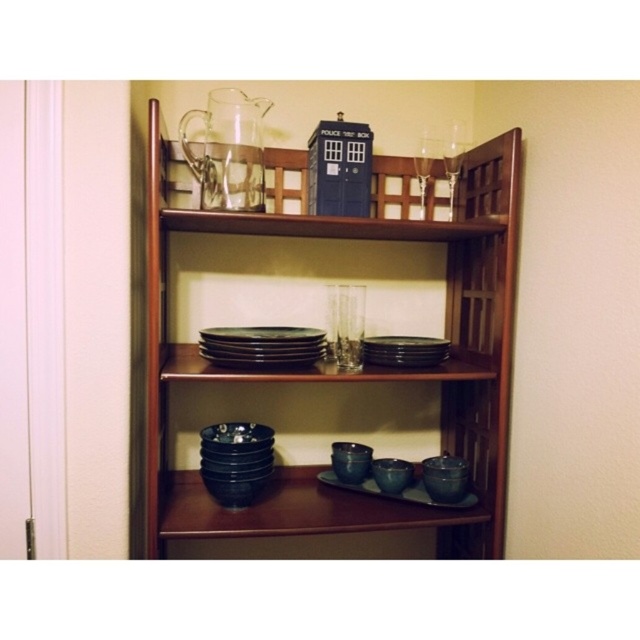
Does transparent glass wine glass at upper right lie behind clear glass wine glass at upper right?

No.

The image size is (640, 640). In order to click on transparent glass wine glass at upper right in this screenshot , I will do `click(452, 161)`.

Where is `transparent glass wine glass at upper right`? This screenshot has width=640, height=640. transparent glass wine glass at upper right is located at coordinates (452, 161).

Is matte black platter at center wider than transparent glass wine glass at upper right?

Indeed, matte black platter at center has a greater width compared to transparent glass wine glass at upper right.

Does matte black platter at center have a larger size compared to transparent glass wine glass at upper right?

Yes, matte black platter at center is bigger than transparent glass wine glass at upper right.

This screenshot has height=640, width=640. Find the location of `matte black platter at center`. matte black platter at center is located at coordinates (397, 492).

Where is `matte black platter at center`? This screenshot has height=640, width=640. matte black platter at center is located at coordinates (397, 492).

Can you confirm if dark wood bookshelf at center is positioned to the right of black matte plate at center?

Incorrect, dark wood bookshelf at center is not on the right side of black matte plate at center.

Does point (304, 525) lie in front of point (380, 353)?

Yes.

Where is `dark wood bookshelf at center`? dark wood bookshelf at center is located at coordinates (362, 369).